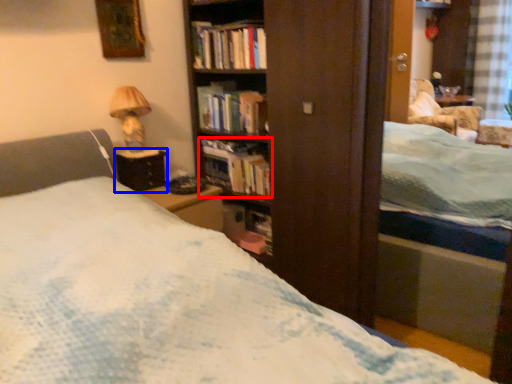
Question: Which object is closer to the camera taking this photo, book (highlighted by a red box) or table (highlighted by a blue box)?

Choices:
 (A) book
 (B) table

Answer: (B)